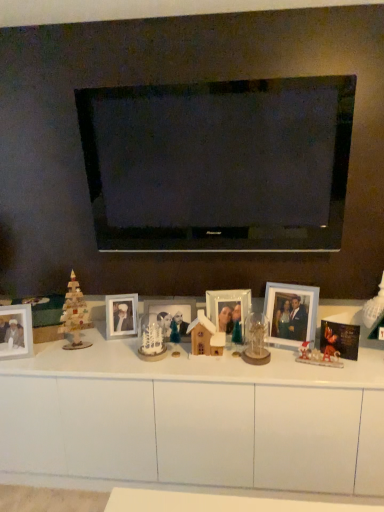
The height and width of the screenshot is (512, 384). I want to click on unoccupied area in front of white frosted glass christmas tree at center, which ranks as the 3th toy in right-to-left order, so click(x=150, y=367).